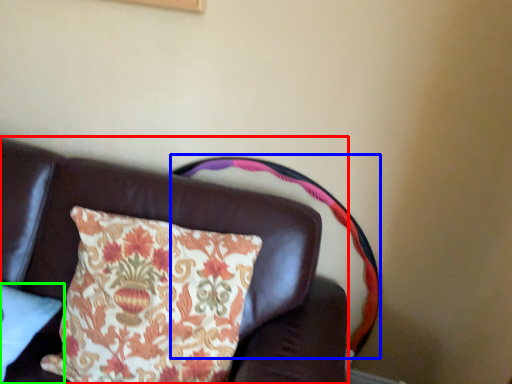
Question: Based on their relative distances, which object is farther from furniture (highlighted by a red box)? Choose from swivel chair (highlighted by a blue box) and pillow (highlighted by a green box).

Choices:
 (A) swivel chair
 (B) pillow

Answer: (B)